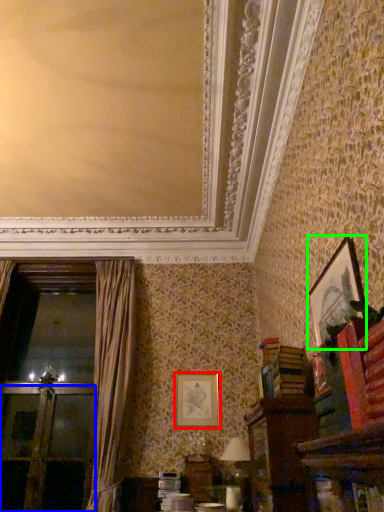
Question: Considering the real-world distances, which object is closest to picture frame (highlighted by a red box)? screen door (highlighted by a blue box) or picture frame (highlighted by a green box).

Choices:
 (A) screen door
 (B) picture frame

Answer: (A)